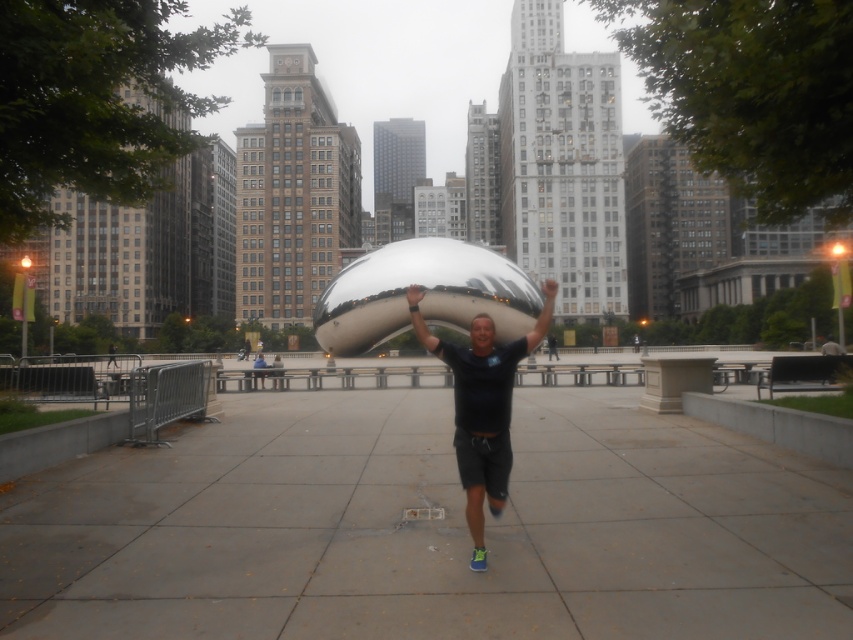
Question: Considering the real-world distances, which object is farthest from the smooth skin head at center?

Choices:
 (A) black matte shirt at center
 (B) gray concrete pavement at center

Answer: (A)

Question: Is black matte shirt at center positioned behind smooth skin head at center?

Choices:
 (A) no
 (B) yes

Answer: (B)

Question: Which point is closer to the camera?

Choices:
 (A) gray concrete pavement at center
 (B) smooth skin head at center

Answer: (A)

Question: Can you confirm if gray concrete pavement at center is positioned above black matte shirt at center?

Choices:
 (A) yes
 (B) no

Answer: (B)

Question: Is black matte shirt at center bigger than smooth skin head at center?

Choices:
 (A) yes
 (B) no

Answer: (A)

Question: Among these objects, which one is farthest from the camera?

Choices:
 (A) gray concrete pavement at center
 (B) smooth skin head at center

Answer: (B)